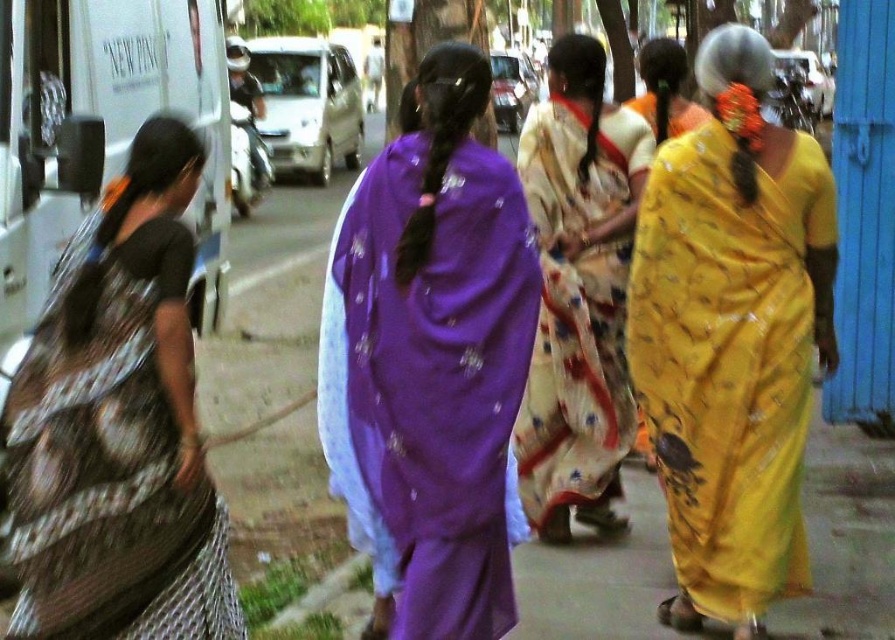
Who is higher up, purple satin saree at center or yellow satin saree at center?

yellow satin saree at center

Can you confirm if purple satin saree at center is taller than yellow satin saree at center?

Correct, purple satin saree at center is much taller as yellow satin saree at center.

Locate an element on the screen. The width and height of the screenshot is (895, 640). purple satin saree at center is located at coordinates (431, 362).

Is yellow satin saree at right behind printed silk sari at center?

No, it is in front of printed silk sari at center.

Is yellow satin saree at right to the left of printed silk sari at center from the viewer's perspective?

Incorrect, yellow satin saree at right is not on the left side of printed silk sari at center.

Who is more distant from viewer, (x=781, y=564) or (x=553, y=323)?

Point (x=553, y=323)

In order to click on yellow satin saree at right in this screenshot , I will do `click(732, 337)`.

Does printed fabric saree at left appear under yellow satin saree at center?

Yes.

Which is more to the right, printed fabric saree at left or yellow satin saree at center?

Positioned to the right is yellow satin saree at center.

Identify the location of printed fabric saree at left. The width and height of the screenshot is (895, 640). (118, 426).

This screenshot has height=640, width=895. I want to click on printed fabric saree at left, so click(x=118, y=426).